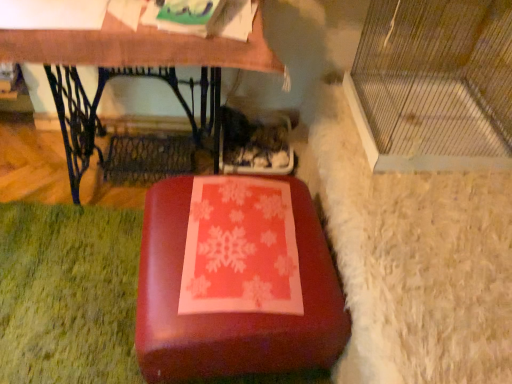
Question: Is matte wood table at center positioned before matte red suitcase at center?

Choices:
 (A) yes
 (B) no

Answer: (B)

Question: Is matte wood table at center shorter than matte red suitcase at center?

Choices:
 (A) yes
 (B) no

Answer: (B)

Question: Considering the relative sizes of matte wood table at center and matte red suitcase at center in the image provided, is matte wood table at center thinner than matte red suitcase at center?

Choices:
 (A) no
 (B) yes

Answer: (B)

Question: Is matte wood table at center directly adjacent to matte red suitcase at center?

Choices:
 (A) yes
 (B) no

Answer: (B)

Question: Considering the relative positions of matte wood table at center and matte red suitcase at center in the image provided, is matte wood table at center behind matte red suitcase at center?

Choices:
 (A) yes
 (B) no

Answer: (A)

Question: Based on their positions, is clear plastic cage at right located to the left or right of matte red suitcase at center?

Choices:
 (A) left
 (B) right

Answer: (B)

Question: Considering the positions of point (482, 137) and point (337, 324), is point (482, 137) closer or farther from the camera than point (337, 324)?

Choices:
 (A) closer
 (B) farther

Answer: (B)

Question: Considering the positions of clear plastic cage at right and matte red suitcase at center in the image, is clear plastic cage at right taller or shorter than matte red suitcase at center?

Choices:
 (A) tall
 (B) short

Answer: (A)

Question: Is clear plastic cage at right wider or thinner than matte red suitcase at center?

Choices:
 (A) thin
 (B) wide

Answer: (B)

Question: Considering the positions of clear plastic cage at right and matte wood table at center in the image, is clear plastic cage at right wider or thinner than matte wood table at center?

Choices:
 (A) thin
 (B) wide

Answer: (B)

Question: Based on their sizes in the image, would you say clear plastic cage at right is bigger or smaller than matte wood table at center?

Choices:
 (A) big
 (B) small

Answer: (B)

Question: Would you say clear plastic cage at right is inside or outside matte wood table at center?

Choices:
 (A) outside
 (B) inside

Answer: (A)

Question: Relative to matte wood table at center, is clear plastic cage at right in front or behind?

Choices:
 (A) behind
 (B) front

Answer: (B)

Question: Looking at their shapes, would you say matte red suitcase at center is wider or thinner than clear plastic cage at right?

Choices:
 (A) thin
 (B) wide

Answer: (A)

Question: Is matte red suitcase at center taller or shorter than clear plastic cage at right?

Choices:
 (A) short
 (B) tall

Answer: (A)